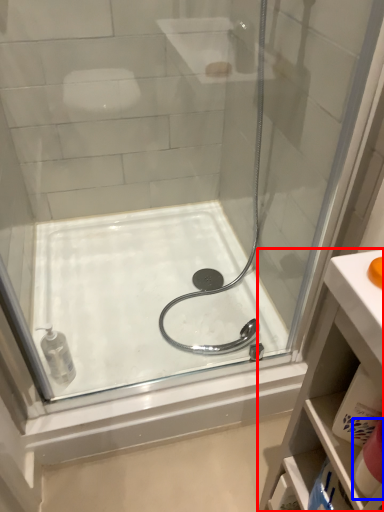
Question: Which object is further to the camera taking this photo, bathroom cabinet (highlighted by a red box) or toiletry (highlighted by a blue box)?

Choices:
 (A) bathroom cabinet
 (B) toiletry

Answer: (B)